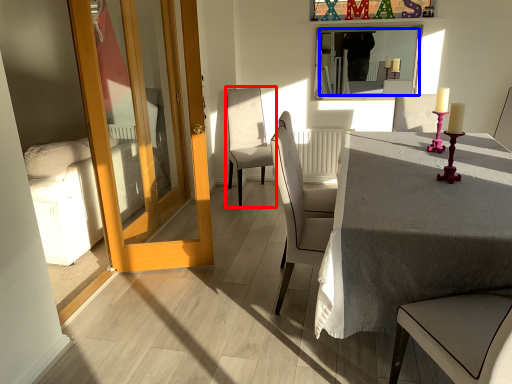
Question: Among these objects, which one is farthest to the camera, chair (highlighted by a red box) or mirror (highlighted by a blue box)?

Choices:
 (A) chair
 (B) mirror

Answer: (B)